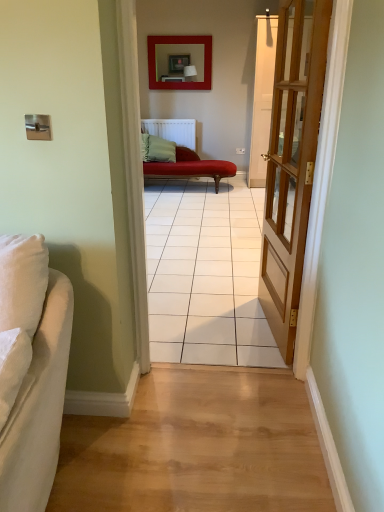
Locate an element on the screen. The image size is (384, 512). vacant area situated below light brown wooden door at right (from a real-world perspective) is located at coordinates (268, 327).